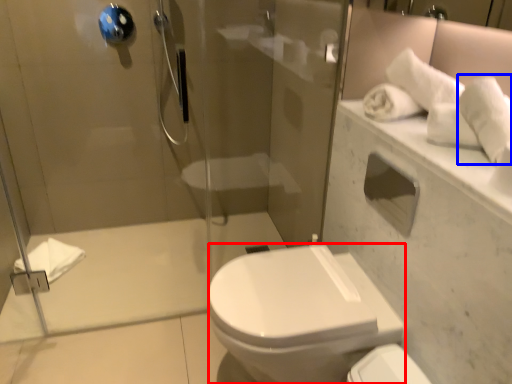
Question: Which object is further to the camera taking this photo, bidet (highlighted by a red box) or bath towel (highlighted by a blue box)?

Choices:
 (A) bidet
 (B) bath towel

Answer: (A)